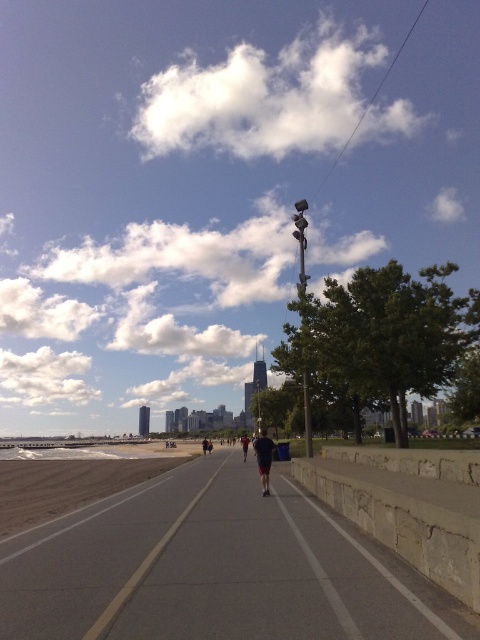
Question: Does gray concrete bike path at center come behind dark gray fabric shorts at center?

Choices:
 (A) no
 (B) yes

Answer: (A)

Question: Which point is farther to the camera?

Choices:
 (A) gray concrete bike path at center
 (B) dark gray fabric shorts at center

Answer: (B)

Question: Which point appears farthest from the camera in this image?

Choices:
 (A) (367, 547)
 (B) (264, 483)

Answer: (B)

Question: Which of the following is the farthest from the observer?

Choices:
 (A) gray concrete bike path at center
 (B) dark gray fabric shorts at center

Answer: (B)

Question: Does gray concrete bike path at center come behind dark gray fabric shorts at center?

Choices:
 (A) no
 (B) yes

Answer: (A)

Question: Does gray concrete bike path at center have a greater width compared to dark gray fabric shorts at center?

Choices:
 (A) yes
 (B) no

Answer: (A)